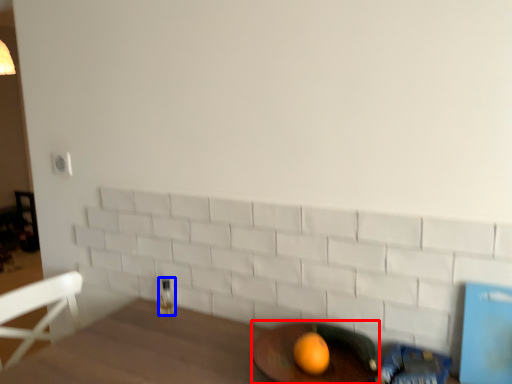
Question: Among these objects, which one is farthest to the camera, round table (highlighted by a red box) or beverage (highlighted by a blue box)?

Choices:
 (A) round table
 (B) beverage

Answer: (B)